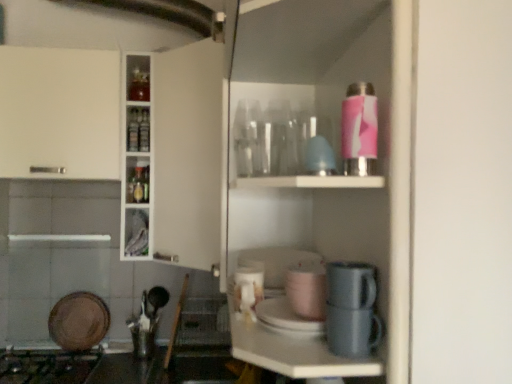
Question: Does black matte gas stove at lower left have a lesser width compared to matte gray mug at lower center, which is counted as the 4th appliance, starting from the back?

Choices:
 (A) yes
 (B) no

Answer: (B)

Question: Is black matte gas stove at lower left completely or partially outside of matte gray mug at lower center, the first appliance from the right?

Choices:
 (A) yes
 (B) no

Answer: (A)

Question: From a real-world perspective, is black matte gas stove at lower left physically below matte gray mug at lower center, placed as the first appliance when sorted from top to bottom?

Choices:
 (A) yes
 (B) no

Answer: (A)

Question: Is black matte gas stove at lower left looking in the opposite direction of matte gray mug at lower center, which is the 4th appliance from bottom to top?

Choices:
 (A) yes
 (B) no

Answer: (B)

Question: Could matte gray mug at lower center, which is the fourth appliance in left-to-right order, be considered to be inside black matte gas stove at lower left?

Choices:
 (A) yes
 (B) no

Answer: (B)

Question: From the image's perspective, does black matte gas stove at lower left appear higher than matte gray mug at lower center, which is the 4th appliance from bottom to top?

Choices:
 (A) no
 (B) yes

Answer: (A)

Question: Could you tell me if matte gray mug at lower center, marked as the 1th appliance in a front-to-back arrangement, is turned towards white glossy cup at center, placed as the 2th appliance when sorted from bottom to top?

Choices:
 (A) no
 (B) yes

Answer: (A)

Question: Is matte gray mug at lower center, placed as the first appliance when sorted from top to bottom, not inside white glossy cup at center, placed as the 2th appliance when sorted from bottom to top?

Choices:
 (A) no
 (B) yes

Answer: (B)

Question: Does matte gray mug at lower center, which is the 4th appliance from bottom to top, lie in front of white glossy cup at center, which is counted as the third appliance, starting from the right?

Choices:
 (A) no
 (B) yes

Answer: (B)

Question: Does matte gray mug at lower center, which is the fourth appliance in left-to-right order, have a lesser height compared to white glossy cup at center, arranged as the second appliance when viewed from the left?

Choices:
 (A) yes
 (B) no

Answer: (A)

Question: Does matte gray mug at lower center, marked as the 1th appliance in a front-to-back arrangement, have a greater height compared to white glossy cup at center, the second appliance positioned from the back?

Choices:
 (A) yes
 (B) no

Answer: (B)

Question: Considering the relative sizes of matte gray mug at lower center, placed as the first appliance when sorted from top to bottom, and white glossy cup at center, which is counted as the third appliance, starting from the right, in the image provided, is matte gray mug at lower center, placed as the first appliance when sorted from top to bottom, smaller than white glossy cup at center, which is counted as the third appliance, starting from the right,?

Choices:
 (A) yes
 (B) no

Answer: (B)

Question: Is matte pink cup at center, which is counted as the 2th appliance, starting from the right, with matte gray mug at lower center, which is the 4th appliance from bottom to top?

Choices:
 (A) yes
 (B) no

Answer: (B)